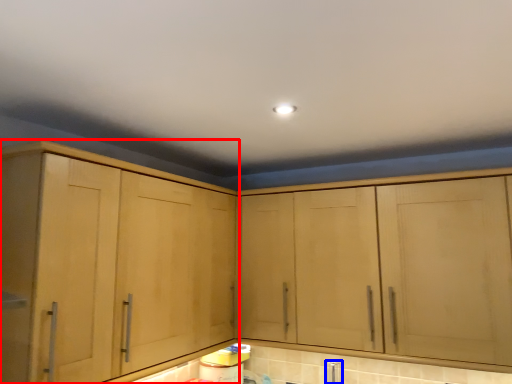
Question: Which of the following is the farthest to the observer, cabinetry (highlighted by a red box) or faucet (highlighted by a blue box)?

Choices:
 (A) cabinetry
 (B) faucet

Answer: (B)